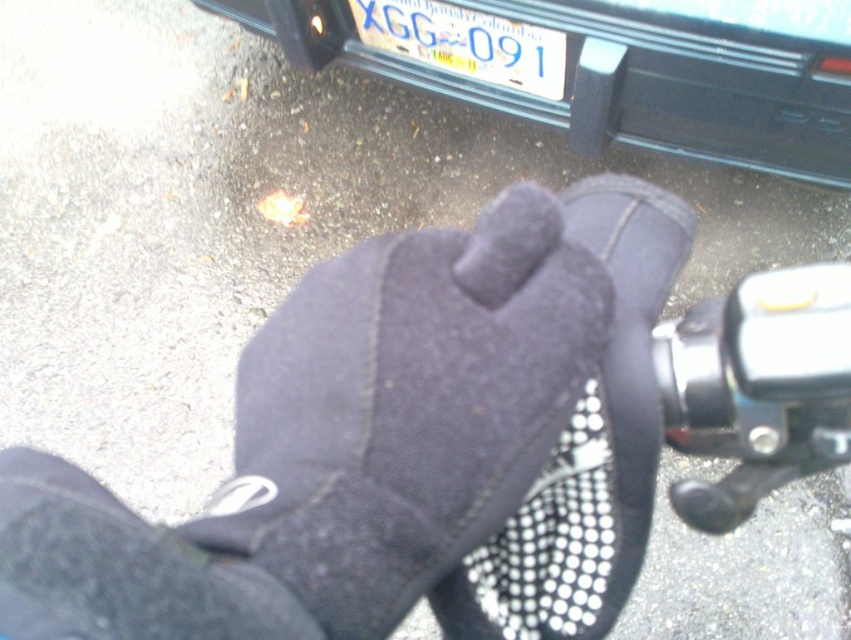
Question: Which point is closer to the camera taking this photo?

Choices:
 (A) (61, 605)
 (B) (661, 220)
 (C) (587, 372)
 (D) (430, 1)

Answer: (A)

Question: Which point is farther to the camera?

Choices:
 (A) black fleece glove at center
 (B) black fleece sock at lower left

Answer: (A)

Question: Is black plastic license plate at upper center above black fleece sock at lower left?

Choices:
 (A) yes
 (B) no

Answer: (A)

Question: Is black fleece glove at center above white plastic license plate at center?

Choices:
 (A) no
 (B) yes

Answer: (A)

Question: Is black plastic license plate at upper center above black fleece sock at lower left?

Choices:
 (A) yes
 (B) no

Answer: (A)

Question: Which is nearer to the black fleece glove at center?

Choices:
 (A) black plastic license plate at upper center
 (B) black suede glove at center
 (C) black fleece sock at lower left
 (D) white plastic license plate at center

Answer: (B)